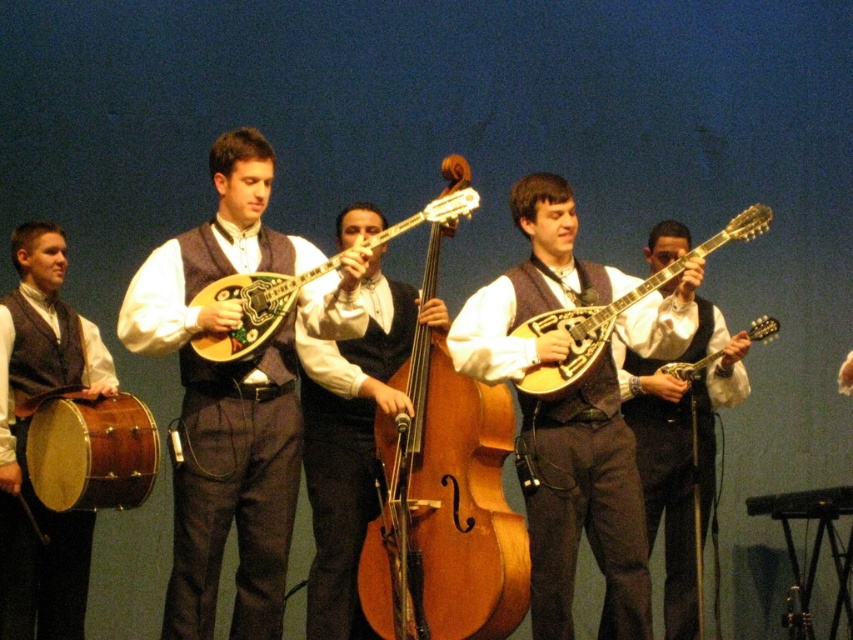
You are a stagehand who needs to move a 14.5 feet long equipment cart from the left side of the stage to the right side. There is a matte brown drum at left and a matte brown guitar at center in your path. Will the cart fit through the space between these two objects?

The distance between the matte brown drum at left and the matte brown guitar at center is 15.76 feet. Since the equipment cart is 14.5 feet long, it will fit through the space between them as there is enough clearance.

You are a stagehand who needs to place a microphone stand exactly 0.5 units to the right of the matte brown drum at left. What are the coordinates of the microphone stand?

The coordinates of the microphone stand would be calculated by adding 0.5 to the x coordinate of the matte brown drum at left. The original coordinates are (22,438), so adding 0.5 to the x coordinate gives 1.186. Therefore, the microphone stand should be placed at coordinates (22,639).

You are a stagehand setting up a storage rack that can only accommodate instruments with a width of 40 cm or less. You have the light brown wooden cello at center and the matte wood banjo at center in front of you. Which instrument should you place in the rack?

The matte wood banjo at center should be placed in the rack because the light brown wooden cello at center is wider than the banjo, exceeding the 40 cm limit.